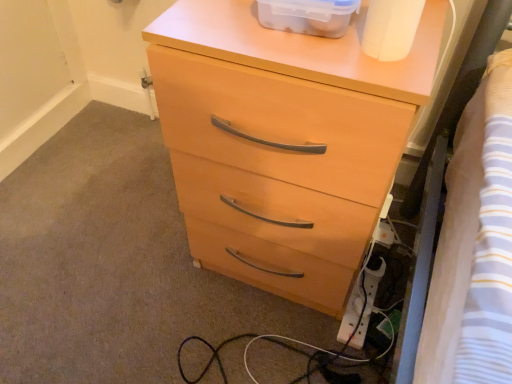
Locate an element on the screen. Image resolution: width=512 pixels, height=384 pixels. blank space to the left of white matte toilet paper at upper right is located at coordinates (282, 42).